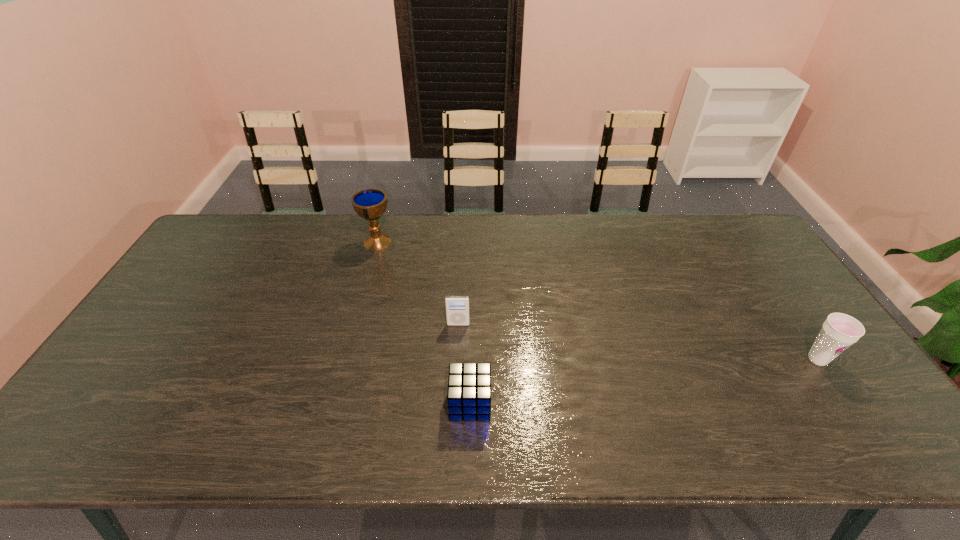
Where is `the farthest object`? This screenshot has width=960, height=540. the farthest object is located at coordinates (370, 204).

Locate an element on the screen. the leftmost object is located at coordinates [370, 204].

Find the location of `the second nearest object`. the second nearest object is located at coordinates (839, 331).

Identify the location of the third shortest object. (839, 331).

Identify the location of iPod. (457, 307).

Where is `cube`? cube is located at coordinates (469, 384).

Where is `free space located 0.060m on the right of the tallest object`? The height and width of the screenshot is (540, 960). free space located 0.060m on the right of the tallest object is located at coordinates (412, 242).

Image resolution: width=960 pixels, height=540 pixels. Identify the location of free point located on the left of the cup. (764, 359).

At what (x,y) coordinates should I click in order to perform the action: click on vacant point located on the front-facing side of the third nearest object. Please return your answer as a coordinate pair (x, y). Looking at the image, I should click on (456, 381).

This screenshot has width=960, height=540. Find the location of `vacant space located 0.220m on the left of the nearest object`. vacant space located 0.220m on the left of the nearest object is located at coordinates coord(359,403).